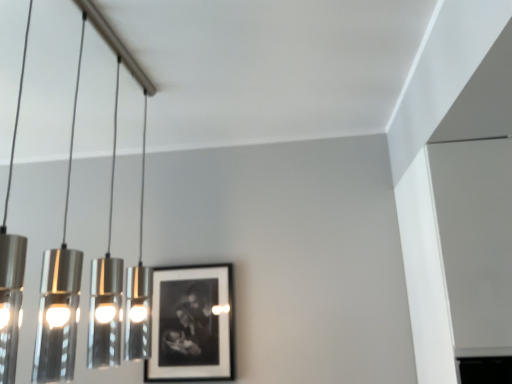
Question: Is polished silver pendant lights at left not within black matte picture frame at center?

Choices:
 (A) no
 (B) yes

Answer: (B)

Question: Can you confirm if polished silver pendant lights at left is thinner than black matte picture frame at center?

Choices:
 (A) yes
 (B) no

Answer: (B)

Question: Can you confirm if polished silver pendant lights at left is taller than black matte picture frame at center?

Choices:
 (A) no
 (B) yes

Answer: (B)

Question: Are polished silver pendant lights at left and black matte picture frame at center making contact?

Choices:
 (A) no
 (B) yes

Answer: (A)

Question: From a real-world perspective, is polished silver pendant lights at left positioned over black matte picture frame at center based on gravity?

Choices:
 (A) no
 (B) yes

Answer: (B)

Question: Is polished silver pendant lights at left looking in the opposite direction of black matte picture frame at center?

Choices:
 (A) yes
 (B) no

Answer: (B)

Question: From a real-world perspective, is black matte picture frame at center physically above polished silver pendant lights at left?

Choices:
 (A) yes
 (B) no

Answer: (B)

Question: Is black matte picture frame at center oriented towards polished silver pendant lights at left?

Choices:
 (A) no
 (B) yes

Answer: (B)

Question: Considering the relative sizes of black matte picture frame at center and polished silver pendant lights at left in the image provided, is black matte picture frame at center wider than polished silver pendant lights at left?

Choices:
 (A) no
 (B) yes

Answer: (A)

Question: Considering the relative positions of black matte picture frame at center and polished silver pendant lights at left in the image provided, is black matte picture frame at center in front of polished silver pendant lights at left?

Choices:
 (A) no
 (B) yes

Answer: (A)

Question: Is black matte picture frame at center taller than polished silver pendant lights at left?

Choices:
 (A) yes
 (B) no

Answer: (B)

Question: Is black matte picture frame at center behind polished silver pendant lights at left?

Choices:
 (A) no
 (B) yes

Answer: (B)

Question: From their relative heights in the image, would you say polished silver pendant lights at left is taller or shorter than black matte picture frame at center?

Choices:
 (A) tall
 (B) short

Answer: (A)